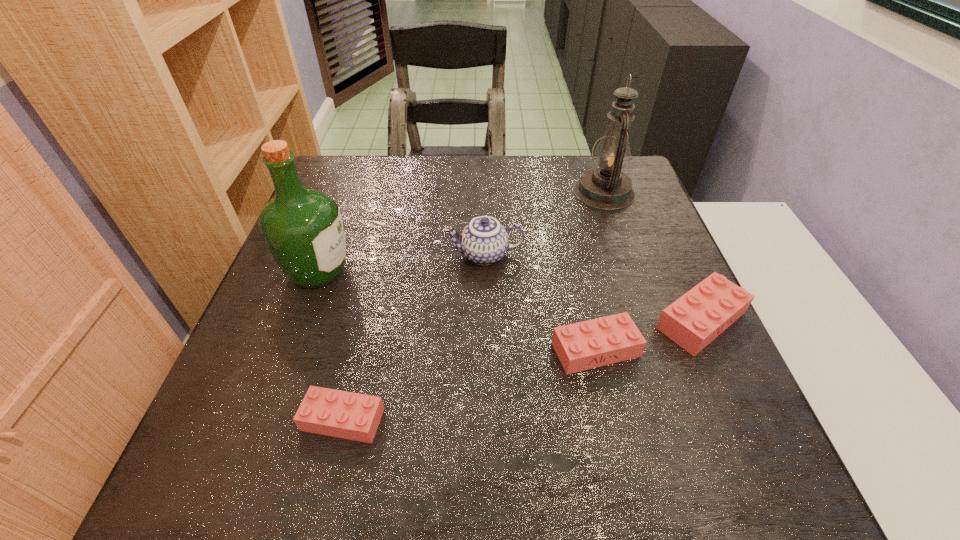
I want to click on vacant space located 0.260m on the left of the second tallest Lego, so click(415, 349).

Find the location of a particular element. free space located on the front of the rightmost Lego is located at coordinates (736, 400).

Where is `vacant space located 0.100m on the left of the oil lamp`? vacant space located 0.100m on the left of the oil lamp is located at coordinates (537, 192).

This screenshot has width=960, height=540. What are the coordinates of `free spot located 0.160m on the front-facing side of the liquor` in the screenshot? It's located at (425, 272).

Identify the location of blank area located 0.060m from the spout of the chinaware. Image resolution: width=960 pixels, height=540 pixels. (420, 255).

Where is `free spot located 0.210m from the spout of the chinaware`? free spot located 0.210m from the spout of the chinaware is located at coordinates [355, 255].

You are a GUI agent. You are given a task and a screenshot of the screen. Output one action in this format:
    pyautogui.click(x=<x>, y=<y>)
    Task: Click on the vacant region located from the spout of the chinaware
    The image size is (960, 540).
    Given the screenshot: What is the action you would take?
    pyautogui.click(x=325, y=255)

This screenshot has height=540, width=960. I want to click on object at the far edge, so click(x=606, y=187).

Where is `object located in the near edge section of the desktop`? The image size is (960, 540). object located in the near edge section of the desktop is located at coordinates (342, 414).

At what (x,y) coordinates should I click in order to perform the action: click on Lego present at the left edge. Please return your answer as a coordinate pair (x, y). Looking at the image, I should click on (342, 414).